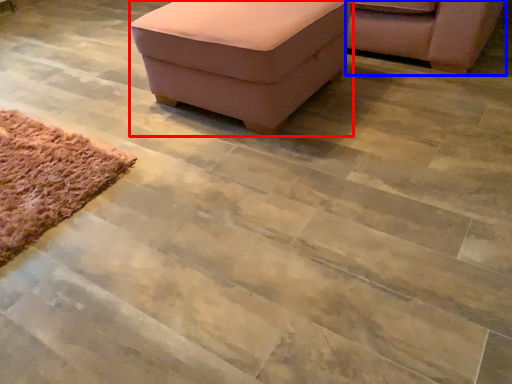
Question: Among these objects, which one is farthest to the camera, furniture (highlighted by a red box) or chair (highlighted by a blue box)?

Choices:
 (A) furniture
 (B) chair

Answer: (B)